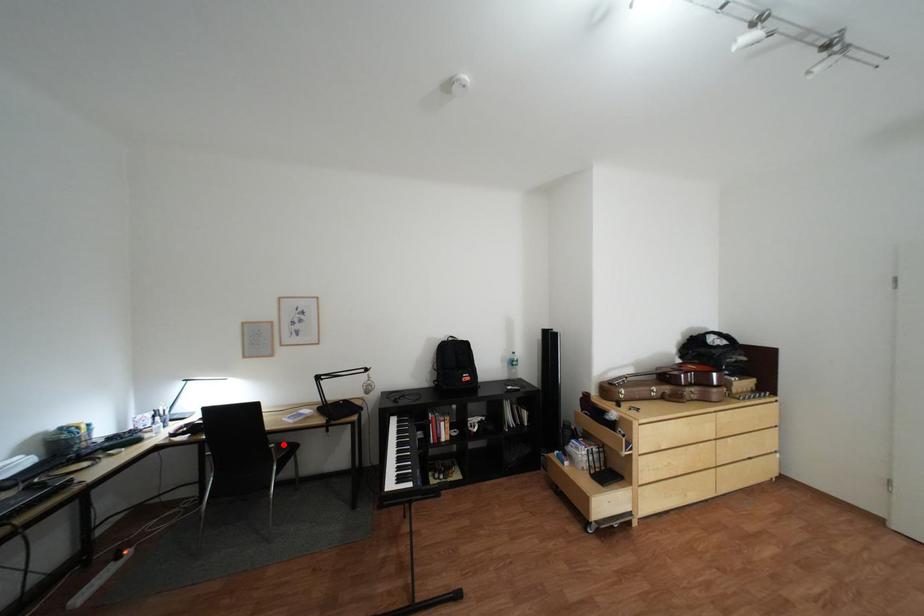
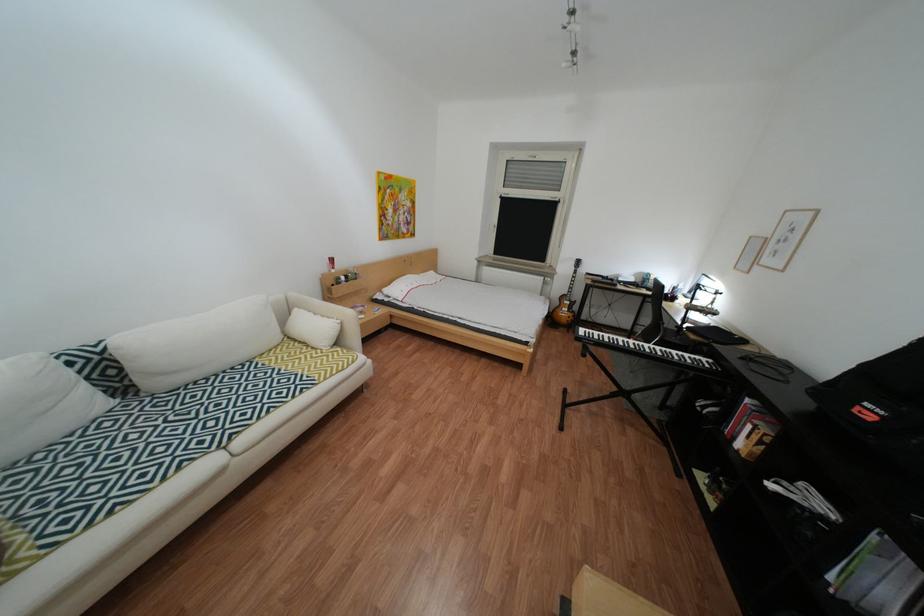
Question: I am providing you with two images of the same scene from different viewpoints. A red point is marked on the first image. At the location where the point appears in image 1, is it still visible in image 2?

Choices:
 (A) Yes
 (B) No

Answer: (B)